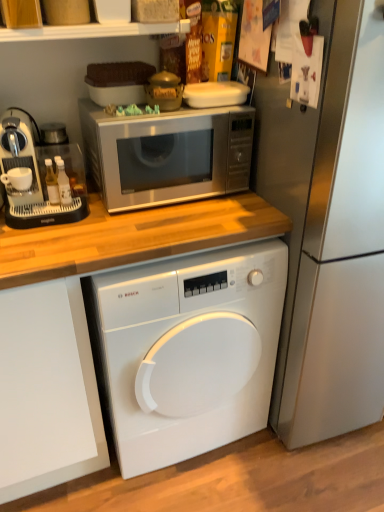
Question: From a real-world perspective, is white glossy washing machine at center over satin silver refrigerator at right?

Choices:
 (A) no
 (B) yes

Answer: (A)

Question: From a real-world perspective, is white glossy washing machine at center physically below satin silver refrigerator at right?

Choices:
 (A) no
 (B) yes

Answer: (B)

Question: Does white glossy washing machine at center have a larger size compared to satin silver refrigerator at right?

Choices:
 (A) yes
 (B) no

Answer: (B)

Question: Is white glossy washing machine at center located outside satin silver refrigerator at right?

Choices:
 (A) yes
 (B) no

Answer: (A)

Question: From the image's perspective, is white glossy washing machine at center located beneath satin silver refrigerator at right?

Choices:
 (A) yes
 (B) no

Answer: (A)

Question: Is white glossy washing machine at center shorter than satin silver refrigerator at right?

Choices:
 (A) no
 (B) yes

Answer: (B)

Question: Is white matte plastic container at upper center located outside satin silver microwave at upper center?

Choices:
 (A) no
 (B) yes

Answer: (B)

Question: Considering the relative positions of white matte plastic container at upper center and satin silver microwave at upper center in the image provided, is white matte plastic container at upper center to the right of satin silver microwave at upper center from the viewer's perspective?

Choices:
 (A) yes
 (B) no

Answer: (A)

Question: From a real-world perspective, is white matte plastic container at upper center under satin silver microwave at upper center?

Choices:
 (A) yes
 (B) no

Answer: (B)

Question: Is white matte plastic container at upper center taller than satin silver microwave at upper center?

Choices:
 (A) no
 (B) yes

Answer: (A)

Question: From the image's perspective, would you say white matte plastic container at upper center is positioned over satin silver microwave at upper center?

Choices:
 (A) yes
 (B) no

Answer: (A)

Question: Is white matte plastic container at upper center behind satin silver microwave at upper center?

Choices:
 (A) yes
 (B) no

Answer: (A)

Question: From a real-world perspective, is white glossy shelf at upper center physically above satin silver refrigerator at right?

Choices:
 (A) yes
 (B) no

Answer: (A)